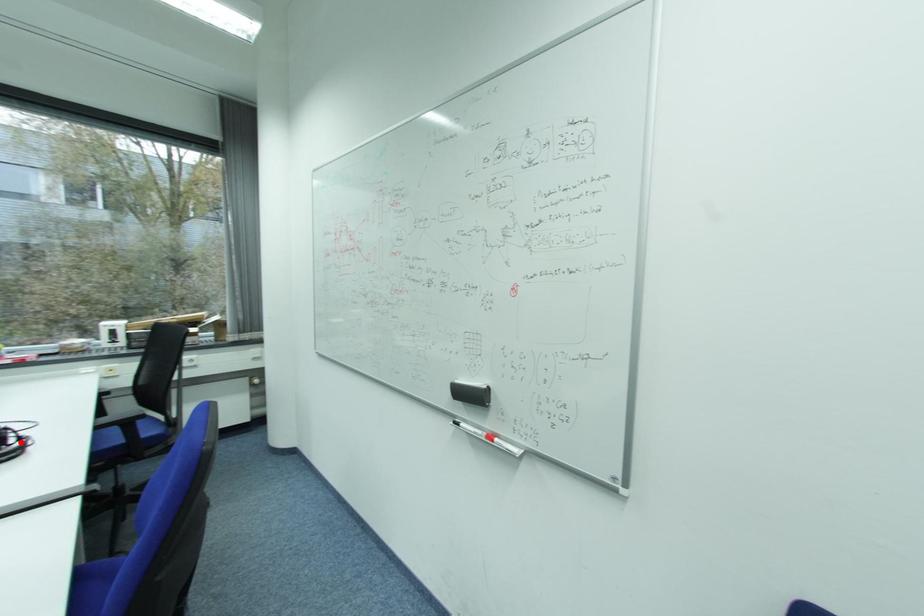
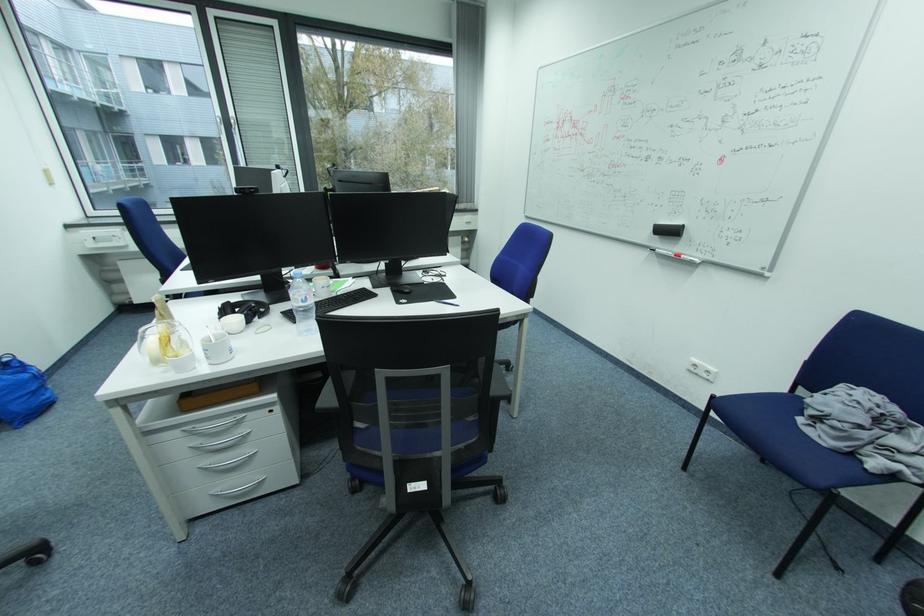
Question: I am providing you with two images of the same scene from different viewpoints. A red point is marked on the first image. At the location where the point appears in image 1, is it still visible in image 2?

Choices:
 (A) Yes
 (B) No

Answer: (B)